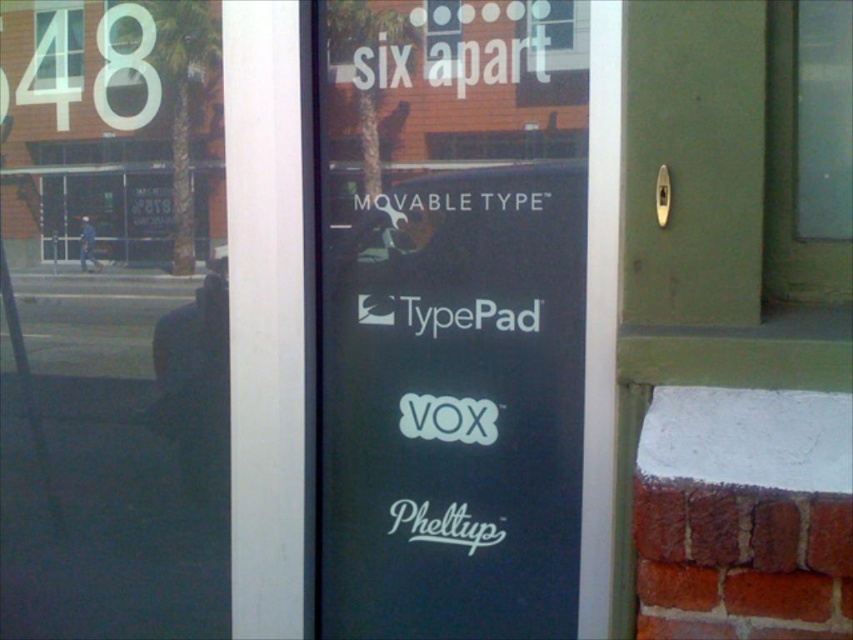
Question: Among these objects, which one is farthest from the camera?

Choices:
 (A) white matte movable type at center
 (B) transparent glass door at left
 (C) white matte typepad at center
 (D) green matte door at upper right

Answer: (B)

Question: Does green matte door at upper right have a larger size compared to white matte typepad at center?

Choices:
 (A) yes
 (B) no

Answer: (A)

Question: Among these points, which one is farthest from the camera?

Choices:
 (A) (672, 22)
 (B) (358, 420)
 (C) (492, 301)

Answer: (B)

Question: Can you confirm if green matte door at upper right is wider than white matte typepad at center?

Choices:
 (A) yes
 (B) no

Answer: (A)

Question: In this image, where is green matte door at upper right located relative to white matte typepad at center?

Choices:
 (A) left
 (B) right

Answer: (B)

Question: Which point is closer to the camera?

Choices:
 (A) black matte signboard at center
 (B) green matte door at upper right
 (C) white matte typepad at center
 (D) white matte movable type at center

Answer: (B)